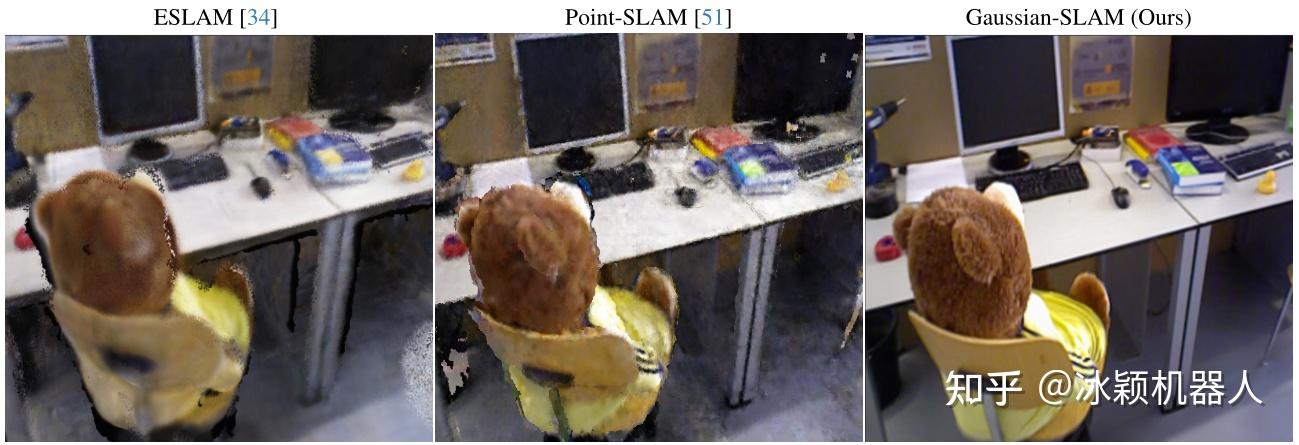
Identify the location of three color photos side by side. This screenshot has width=1299, height=445. (1081, 158), (673, 181), (296, 210).